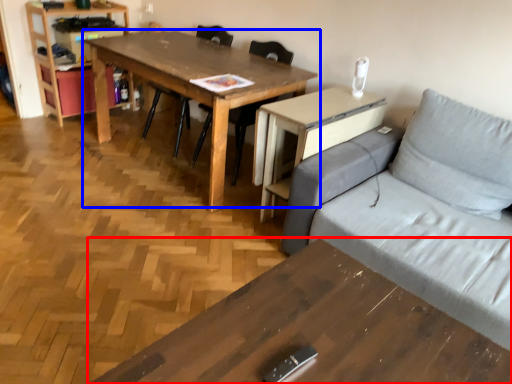
Question: Among these objects, which one is farthest to the camera, table (highlighted by a red box) or table (highlighted by a blue box)?

Choices:
 (A) table
 (B) table

Answer: (B)